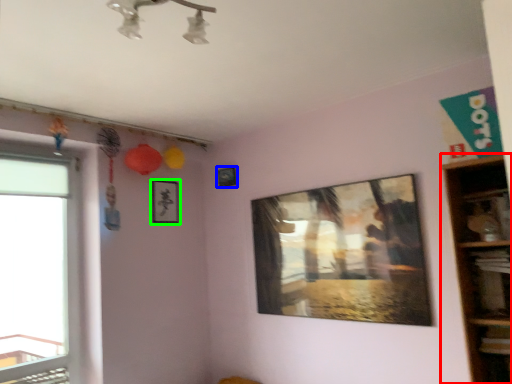
Question: Considering the real-world distances, which object is farthest from shelf (highlighted by a red box)? picture frame (highlighted by a blue box) or picture frame (highlighted by a green box)?

Choices:
 (A) picture frame
 (B) picture frame

Answer: (B)